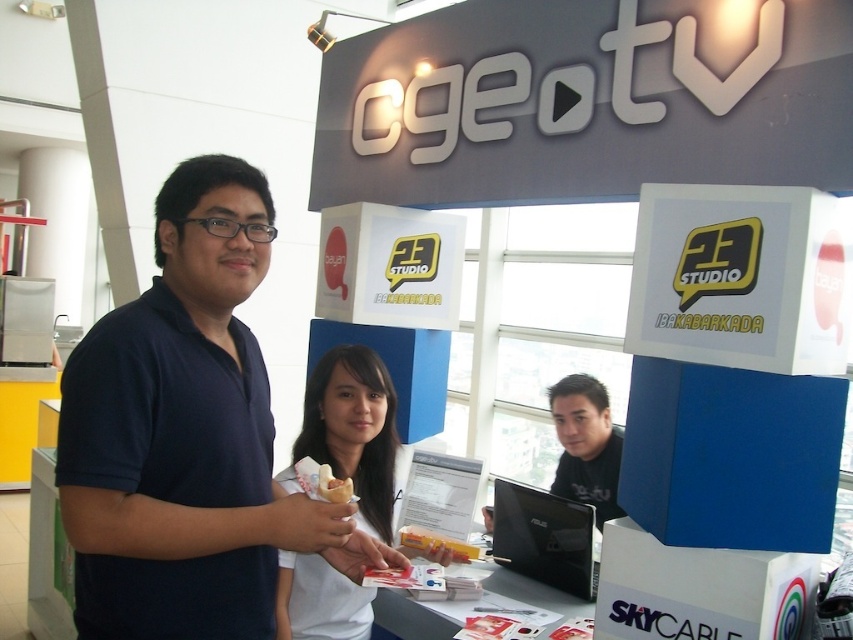
Does point (112, 612) come closer to viewer compared to point (334, 484)?

Yes, point (112, 612) is in front of point (334, 484).

Does dark blue polo shirt at center appear on the left side of white matte ice cream cone at center?

Yes, dark blue polo shirt at center is to the left of white matte ice cream cone at center.

Locate an element on the screen. dark blue polo shirt at center is located at coordinates (183, 433).

Find the location of a particular element. dark blue polo shirt at center is located at coordinates (183, 433).

Does point (285, 609) lie in front of point (563, 404)?

Yes, point (285, 609) is in front of point (563, 404).

Which of these two, white matte shirt at center or black matte laptop at center, stands taller?

With more height is white matte shirt at center.

You are a GUI agent. You are given a task and a screenshot of the screen. Output one action in this format:
    pyautogui.click(x=<x>, y=<y>)
    Task: Click on the white matte shirt at center
    This screenshot has height=640, width=853.
    Given the screenshot: What is the action you would take?
    pyautogui.click(x=352, y=429)

From the picture: Does dark blue polo shirt at center have a lesser height compared to black matte laptop at center?

No, dark blue polo shirt at center is not shorter than black matte laptop at center.

Is point (207, 406) closer to viewer compared to point (601, 442)?

Yes, it is.

Find the location of a particular element. The image size is (853, 640). dark blue polo shirt at center is located at coordinates (183, 433).